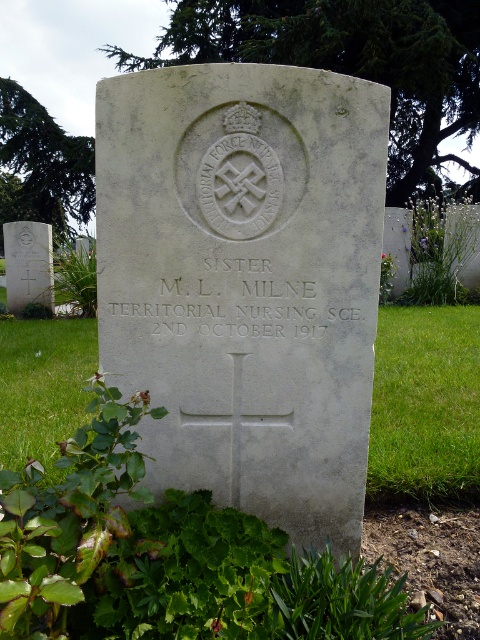
Image resolution: width=480 pixels, height=640 pixels. What do you see at coordinates (245, 282) in the screenshot? I see `gray stone cross at center` at bounding box center [245, 282].

Does gray stone cross at center appear over green grass at lower right?

Correct, gray stone cross at center is located above green grass at lower right.

You are a GUI agent. You are given a task and a screenshot of the screen. Output one action in this format:
    pyautogui.click(x=<x>, y=<y>)
    Task: Click on the gray stone cross at center
    
    Given the screenshot: What is the action you would take?
    pyautogui.click(x=245, y=282)

At what (x,y) coordinates should I click in order to perform the action: click on gray stone cross at center. Please return your answer as a coordinate pair (x, y). Looking at the image, I should click on (245, 282).

Consider the image. Is green grass at lower center shorter than green grass at lower right?

Yes, green grass at lower center is shorter than green grass at lower right.

Find the location of `green grass at lower center`. green grass at lower center is located at coordinates (424, 404).

Does point (297, 97) come farther from viewer compared to point (396, 490)?

No, (297, 97) is closer to viewer.

Can you confirm if gray stone cross at center is positioned below green grass at lower center?

No.

Which is in front, point (303, 435) or point (469, 364)?

Point (303, 435)

I want to click on gray stone cross at center, so click(245, 282).